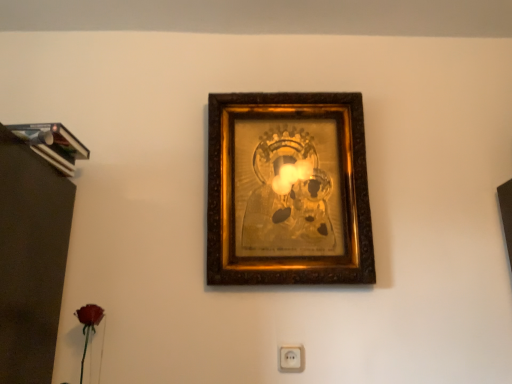
Locate an element on the screen. Image resolution: width=512 pixels, height=384 pixels. gold ornate frame at center is located at coordinates (288, 190).

The width and height of the screenshot is (512, 384). Describe the element at coordinates (288, 190) in the screenshot. I see `gold ornate frame at center` at that location.

Image resolution: width=512 pixels, height=384 pixels. Identify the location of white plastic/socket at lower center. 291,359.

In order to face white plastic/socket at lower center, should I rotate leftwards or rightwards?

To align with it, rotate right about 4.925°.

This screenshot has height=384, width=512. What do you see at coordinates (291, 359) in the screenshot?
I see `white plastic/socket at lower center` at bounding box center [291, 359].

Looking at this image, measure the distance between white plastic/socket at lower center and camera.

A distance of 1.33 meters exists between white plastic/socket at lower center and camera.

Where is `gold ornate frame at center`? The image size is (512, 384). gold ornate frame at center is located at coordinates (288, 190).

Does white plastic/socket at lower center appear on the right side of gold ornate frame at center?

No, white plastic/socket at lower center is not to the right of gold ornate frame at center.

Considering the relative positions of white plastic/socket at lower center and gold ornate frame at center in the image provided, is white plastic/socket at lower center behind gold ornate frame at center?

Yes, white plastic/socket at lower center is further from the camera.

Does point (297, 361) come behind point (208, 219)?

No, it is in front of (208, 219).

From the image's perspective, which is below, white plastic/socket at lower center or gold ornate frame at center?

white plastic/socket at lower center is shown below in the image.

From a real-world perspective, is white plastic/socket at lower center above or below gold ornate frame at center?

From a real-world perspective, white plastic/socket at lower center is physically below gold ornate frame at center.

Based on the photo, considering the relative sizes of white plastic/socket at lower center and gold ornate frame at center in the image provided, is white plastic/socket at lower center wider than gold ornate frame at center?

No, white plastic/socket at lower center is not wider than gold ornate frame at center.

Is white plastic/socket at lower center taller than gold ornate frame at center?

In fact, white plastic/socket at lower center may be shorter than gold ornate frame at center.

Is white plastic/socket at lower center bigger than gold ornate frame at center?

Incorrect, white plastic/socket at lower center is not larger than gold ornate frame at center.

Is white plastic/socket at lower center situated inside gold ornate frame at center or outside?

white plastic/socket at lower center is not enclosed by gold ornate frame at center.

Would you consider white plastic/socket at lower center to be distant from gold ornate frame at center?

No, there isn't a large distance between white plastic/socket at lower center and gold ornate frame at center.

Is white plastic/socket at lower center turned away from gold ornate frame at center?

No, gold ornate frame at center is not at the back of white plastic/socket at lower center.

How different are the orientations of white plastic/socket at lower center and gold ornate frame at center in degrees?

white plastic/socket at lower center and gold ornate frame at center are facing 1.61 degrees away from each other.

The image size is (512, 384). I want to click on picture frame above the white plastic/socket at lower center (from a real-world perspective), so click(288, 190).

Is gold ornate frame at center to the right of white plastic/socket at lower center from the viewer's perspective?

Yes, gold ornate frame at center is to the right of white plastic/socket at lower center.

Considering the positions of objects gold ornate frame at center and white plastic/socket at lower center in the image provided, who is behind, gold ornate frame at center or white plastic/socket at lower center?

white plastic/socket at lower center.

Considering the points (225, 220) and (304, 359), which point is behind, point (225, 220) or point (304, 359)?

The point (225, 220) is farther.

From the image's perspective, relative to white plastic/socket at lower center, is gold ornate frame at center above or below?

From the image's perspective, gold ornate frame at center appears above white plastic/socket at lower center.

From a real-world perspective, which is physically above, gold ornate frame at center or white plastic/socket at lower center?

In real-world perspective, gold ornate frame at center is above.

Is gold ornate frame at center wider than white plastic/socket at lower center?

Indeed, gold ornate frame at center has a greater width compared to white plastic/socket at lower center.

Is gold ornate frame at center shorter than white plastic/socket at lower center?

No, gold ornate frame at center is not shorter than white plastic/socket at lower center.

Which of these two, gold ornate frame at center or white plastic/socket at lower center, is smaller?

Smaller between the two is white plastic/socket at lower center.

Is gold ornate frame at center positioned beyond the bounds of white plastic/socket at lower center?

Absolutely, gold ornate frame at center is external to white plastic/socket at lower center.

Is gold ornate frame at center with white plastic/socket at lower center?

There is a gap between gold ornate frame at center and white plastic/socket at lower center.

Is gold ornate frame at center positioned with its back to white plastic/socket at lower center?

That's not correct — gold ornate frame at center is not looking away from white plastic/socket at lower center.

Identify the location of electric outlet below the gold ornate frame at center (from a real-world perspective). The width and height of the screenshot is (512, 384). (291, 359).

You are a GUI agent. You are given a task and a screenshot of the screen. Output one action in this format:
    pyautogui.click(x=<x>, y=<y>)
    Task: Click on the picture frame on the right of white plastic/socket at lower center
    Image resolution: width=512 pixels, height=384 pixels.
    Given the screenshot: What is the action you would take?
    pyautogui.click(x=288, y=190)

Where is `electric outlet that is on the left side of gold ornate frame at center`? electric outlet that is on the left side of gold ornate frame at center is located at coordinates (291, 359).